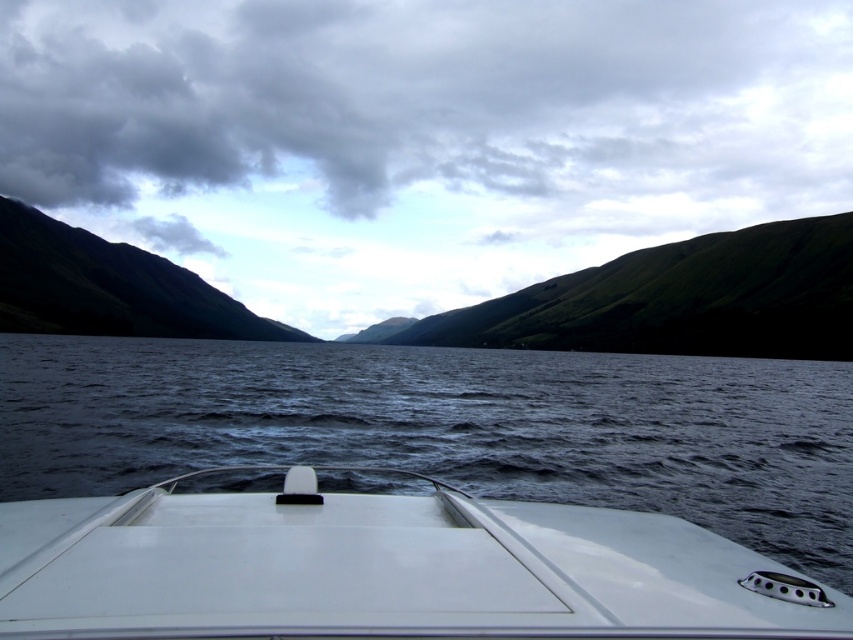
Question: Does white glossy boat at center appear under green grassy mountain at left?

Choices:
 (A) no
 (B) yes

Answer: (B)

Question: Which object appears farthest from the camera in this image?

Choices:
 (A) green grassy hill at center
 (B) cloudy gray sky at upper center
 (C) white glossy boat at center

Answer: (B)

Question: Which point is farther to the camera?

Choices:
 (A) green grassy mountain at left
 (B) glossy water at center
 (C) green grassy hill at center

Answer: (A)

Question: Which of these objects is positioned farthest from the green grassy mountain at left?

Choices:
 (A) glossy water at center
 (B) cloudy gray sky at upper center

Answer: (A)

Question: Is the position of glossy water at center less distant than that of white glossy boat at center?

Choices:
 (A) yes
 (B) no

Answer: (B)

Question: Considering the relative positions of green grassy hill at center and green grassy mountain at left in the image provided, where is green grassy hill at center located with respect to green grassy mountain at left?

Choices:
 (A) left
 (B) right

Answer: (B)